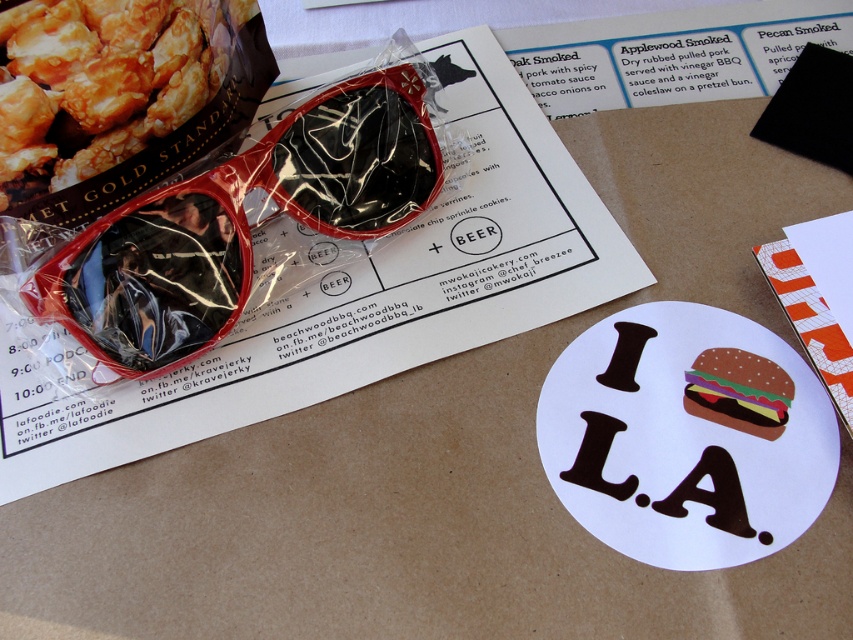
You are taking a photo of the scene from the camera position. You want to focus on the object closest to the camera. Which point should you focus on, point (403, 205) or point (706, 358)?

Point (403, 205) is further to the camera than point (706, 358). Therefore, you should focus on point (403, 205) to capture the closest object.

You are a photographer setting up a still life photo shoot on a table. You have a shiny red plastic sunglasses at upper left and a golden crispy popcorn at upper left. You want to adjust the lighting so that the popcorn is more visible without moving any objects. What adjustment should you make?

Since the golden crispy popcorn at upper left is behind the shiny red plastic sunglasses at upper left, you can angle the light source so that it illuminates the popcorn from the side or behind, making it stand out while avoiding casting harsh shadows on the sunglasses.